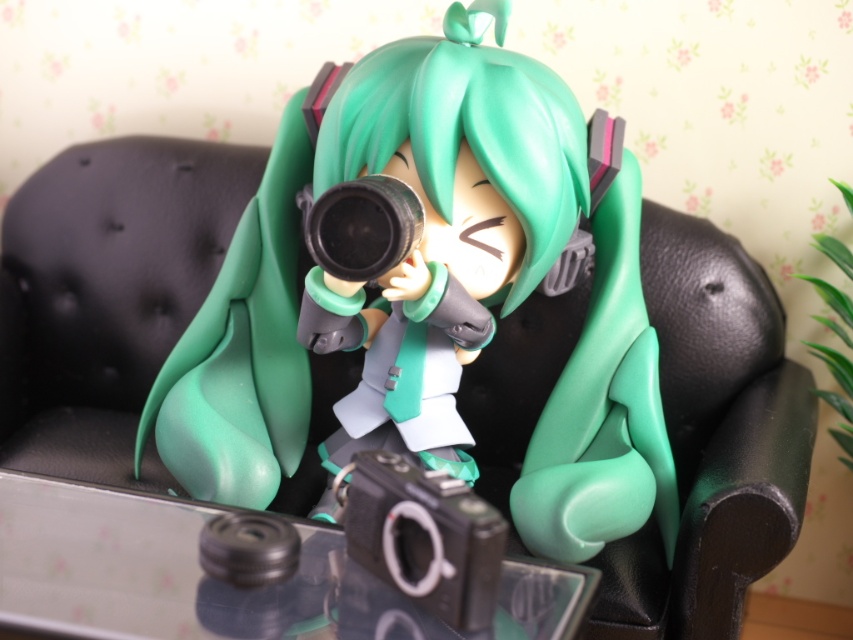
You are a photographer trying to decide which camera to use for a photo shoot. You have the transparent glass camera at lower center and the black rubber lens at center. Which camera is taller?

The transparent glass camera at lower center is taller than the black rubber lens at center.

What is the exact coordinate of the transparent glass camera at lower center?

The transparent glass camera at lower center is located at point (219,580).

You are trying to place a new decorative item on the table in front of the figurine. The table is represented by coordinates from 0 to 1 on both axes. The existing transparent glass camera is at point (219, 580). If you want to place the new item so that it is exactly 0.1 units to the right of the transparent glass camera at lower center, what would be the coordinates of the new item?

The transparent glass camera at lower center is located at point (219, 580). To place the new item 0.1 units to the right, add 0.1 to the x coordinate. The new coordinates would be 1.008, 0.258. However, since the table is within 0 to 1 on both axes, the x coordinate exceeds the maximum limit. Therefore, the item cannot be placed at that position.